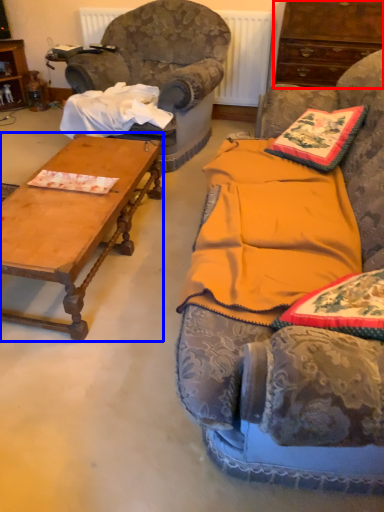
Question: Which object appears farthest to the camera in this image, cabinetry (highlighted by a red box) or coffee table (highlighted by a blue box)?

Choices:
 (A) cabinetry
 (B) coffee table

Answer: (A)